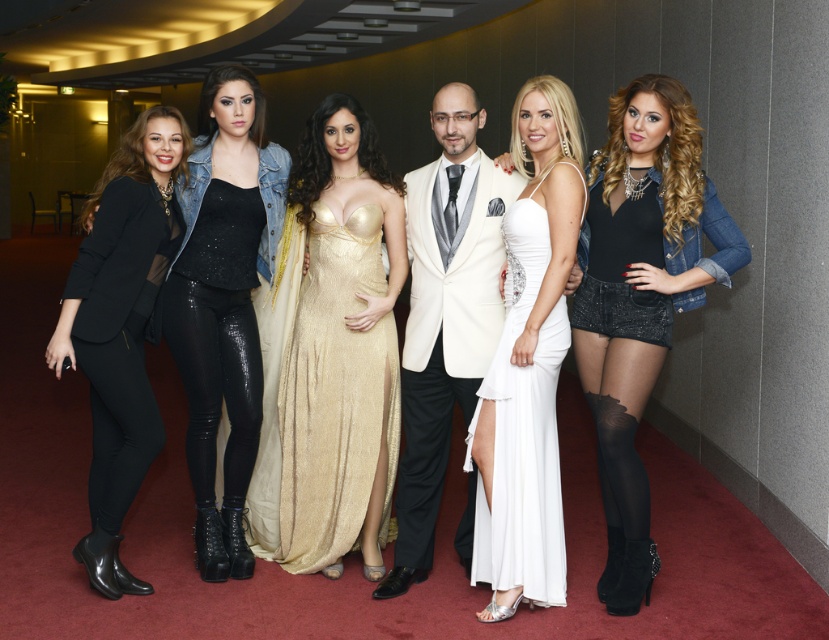
Question: Does gold shimmering dress at center appear on the left side of white satin dress at center?

Choices:
 (A) yes
 (B) no

Answer: (A)

Question: Among these points, which one is nearest to the camera?

Choices:
 (A) (260, 128)
 (B) (643, 301)
 (C) (560, 113)
 (D) (136, 324)

Answer: (C)

Question: Is black leather pants at left to the left of matte black blazer at left from the viewer's perspective?

Choices:
 (A) yes
 (B) no

Answer: (B)

Question: Which object is closer to the camera taking this photo?

Choices:
 (A) gold shimmering dress at center
 (B) black leather pants at left
 (C) matte black blazer at left

Answer: (C)

Question: Can you confirm if gold shimmering dress at center is wider than black leather pants at left?

Choices:
 (A) yes
 (B) no

Answer: (A)

Question: Which point is farther to the camera?

Choices:
 (A) black leather pants at left
 (B) white satin suit at center

Answer: (A)